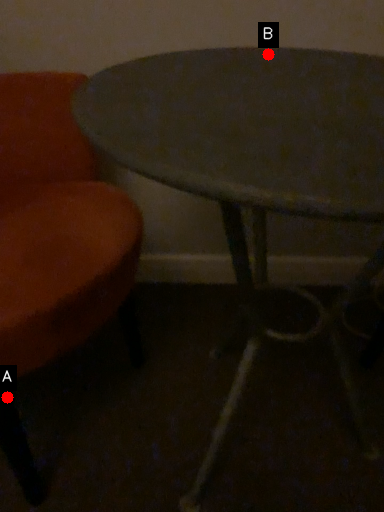
Question: Two points are circled on the image, labeled by A and B beside each circle. Which point appears closest to the camera in this image?

Choices:
 (A) A is closer
 (B) B is closer

Answer: (A)